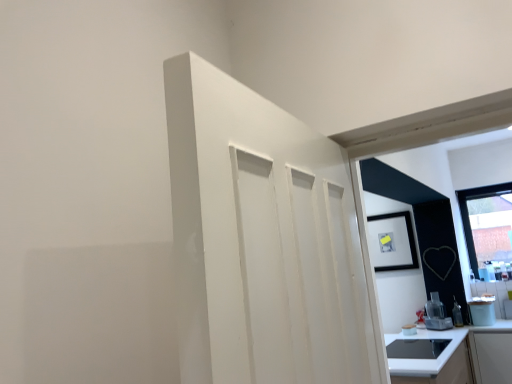
Describe the element at coordinates (482, 311) in the screenshot. I see `white glossy coffee maker at right, which ranks as the 1th appliance in right-to-left order` at that location.

The width and height of the screenshot is (512, 384). What do you see at coordinates (456, 356) in the screenshot?
I see `white glossy countertop at lower right` at bounding box center [456, 356].

You are a GUI agent. You are given a task and a screenshot of the screen. Output one action in this format:
    pyautogui.click(x=<x>, y=<y>)
    Task: Click on the white glossy countertop at lower right
    This screenshot has width=512, height=384.
    Given the screenshot: What is the action you would take?
    pyautogui.click(x=456, y=356)

Identify the location of matte black picture frame at upper right. This screenshot has width=512, height=384. (392, 242).

The width and height of the screenshot is (512, 384). What do you see at coordinates (392, 242) in the screenshot? I see `matte black picture frame at upper right` at bounding box center [392, 242].

Measure the distance between point (474, 189) and camera.

Point (474, 189) and camera are 14.65 feet apart from each other.

What are the coordinates of `satin silver blender at lower right, the 1th appliance positioned from the left` in the screenshot? It's located at (436, 314).

Is matte black picture frame at upper right in front of or behind white glossy countertop at lower right in the image?

Visually, matte black picture frame at upper right is located behind white glossy countertop at lower right.

Can you confirm if matte black picture frame at upper right is thinner than white glossy countertop at lower right?

Indeed, matte black picture frame at upper right has a lesser width compared to white glossy countertop at lower right.

Is point (411, 262) positioned before point (490, 372)?

No, it is not.

What's the angular difference between matte black picture frame at upper right and white glossy countertop at lower right's facing directions?

90 degrees.

From the image's perspective, is white glossy countertop at lower right on top of matte black picture frame at upper right?

Actually, white glossy countertop at lower right appears below matte black picture frame at upper right in the image.

Looking at their sizes, would you say white glossy countertop at lower right is wider or thinner than matte black picture frame at upper right?

Considering their sizes, white glossy countertop at lower right looks broader than matte black picture frame at upper right.

Considering the positions of point (484, 358) and point (380, 236), is point (484, 358) closer or farther from the camera than point (380, 236)?

Point (484, 358) appears to be closer to the viewer than point (380, 236).

In the scene shown: Is satin silver blender at lower right, which is the second appliance from right to left, positioned with its back to transparent glass window at upper right?

No, satin silver blender at lower right, which is the second appliance from right to left, is not facing the opposite direction of transparent glass window at upper right.

Is satin silver blender at lower right, which is the second appliance from right to left, inside or outside of transparent glass window at upper right?

The correct answer is: outside.

Between satin silver blender at lower right, the 1th appliance positioned from the left, and transparent glass window at upper right, which one has smaller size?

With smaller size is satin silver blender at lower right, the 1th appliance positioned from the left.

Which point is more distant from viewer, (434, 309) or (468, 232)?

The point (434, 309) is farther from the camera.

Does matte black picture frame at upper right appear on the left side of transparent glass window at upper right?

Correct, you'll find matte black picture frame at upper right to the left of transparent glass window at upper right.

In terms of width, does matte black picture frame at upper right look wider or thinner when compared to transparent glass window at upper right?

matte black picture frame at upper right is thinner than transparent glass window at upper right.

Does matte black picture frame at upper right touch transparent glass window at upper right?

No, matte black picture frame at upper right is not next to transparent glass window at upper right.

Which object is closer to the camera taking this photo, satin silver blender at lower right, which is the second appliance from right to left, or white glossy coffee maker at right, which ranks as the 1th appliance in right-to-left order?

Positioned in front is white glossy coffee maker at right, which ranks as the 1th appliance in right-to-left order.

Is satin silver blender at lower right, which is the second appliance from right to left, far away from white glossy coffee maker at right, which ranks as the 1th appliance in right-to-left order?

Actually, satin silver blender at lower right, which is the second appliance from right to left, and white glossy coffee maker at right, which ranks as the 1th appliance in right-to-left order, are a little close together.

Is satin silver blender at lower right, the 1th appliance positioned from the left, outside of white glossy coffee maker at right, arranged as the second appliance when viewed from the left?

Indeed, satin silver blender at lower right, the 1th appliance positioned from the left, is completely outside white glossy coffee maker at right, arranged as the second appliance when viewed from the left.

In the scene shown: Is white glossy coffee maker at right, arranged as the second appliance when viewed from the left, outside of matte black picture frame at upper right?

Yes, white glossy coffee maker at right, arranged as the second appliance when viewed from the left, is located beyond the bounds of matte black picture frame at upper right.

What's the angular difference between white glossy coffee maker at right, arranged as the second appliance when viewed from the left, and matte black picture frame at upper right's facing directions?

The angular difference between white glossy coffee maker at right, arranged as the second appliance when viewed from the left, and matte black picture frame at upper right is 0.00112 degrees.

Considering the relative positions of white glossy coffee maker at right, which ranks as the 1th appliance in right-to-left order, and matte black picture frame at upper right in the image provided, is white glossy coffee maker at right, which ranks as the 1th appliance in right-to-left order, to the left or to the right of matte black picture frame at upper right?

Clearly, white glossy coffee maker at right, which ranks as the 1th appliance in right-to-left order, is on the right of matte black picture frame at upper right in the image.

Is white glossy coffee maker at right, which ranks as the 1th appliance in right-to-left order, oriented away from matte black picture frame at upper right?

white glossy coffee maker at right, which ranks as the 1th appliance in right-to-left order, does not have its back to matte black picture frame at upper right.

Considering the relative sizes of white glossy countertop at lower right and transparent glass window at upper right in the image provided, is white glossy countertop at lower right taller than transparent glass window at upper right?

No, white glossy countertop at lower right is not taller than transparent glass window at upper right.

Between white glossy countertop at lower right and transparent glass window at upper right, which one appears on the left side from the viewer's perspective?

white glossy countertop at lower right is more to the left.

Considering the sizes of objects white glossy countertop at lower right and transparent glass window at upper right in the image provided, who is bigger, white glossy countertop at lower right or transparent glass window at upper right?

white glossy countertop at lower right is bigger.

At what (x,y) coordinates should I click in order to perform the action: click on picture frame that is on the right side of white glossy countertop at lower right. Please return your answer as a coordinate pair (x, y). The image size is (512, 384). Looking at the image, I should click on (392, 242).

You are a GUI agent. You are given a task and a screenshot of the screen. Output one action in this format:
    pyautogui.click(x=<x>, y=<y>)
    Task: Click on the countertop that appears below the matte black picture frame at upper right (from a real-world perspective)
    
    Given the screenshot: What is the action you would take?
    pyautogui.click(x=456, y=356)

When comparing their distances from satin silver blender at lower right, the 1th appliance positioned from the left, does white glossy countertop at lower right or transparent glass window at upper right seem further?

white glossy countertop at lower right is further to satin silver blender at lower right, the 1th appliance positioned from the left.

Estimate the real-world distances between objects in this image. Which object is closer to white glossy countertop at lower right, matte black picture frame at upper right or transparent glass window at upper right?

The object closer to white glossy countertop at lower right is transparent glass window at upper right.

When comparing their distances from white glossy countertop at lower right, does satin silver blender at lower right, which is the second appliance from right to left, or white glossy coffee maker at right, arranged as the second appliance when viewed from the left, seem further?

satin silver blender at lower right, which is the second appliance from right to left.

From the image, which object appears to be farther from satin silver blender at lower right, which is the second appliance from right to left, white glossy countertop at lower right or white glossy coffee maker at right, which ranks as the 1th appliance in right-to-left order?

white glossy countertop at lower right lies further to satin silver blender at lower right, which is the second appliance from right to left, than the other object.

From the image, which object appears to be nearer to satin silver blender at lower right, the 1th appliance positioned from the left, transparent glass window at upper right or matte black picture frame at upper right?

matte black picture frame at upper right is positioned closer to the anchor satin silver blender at lower right, the 1th appliance positioned from the left.

When comparing their distances from white glossy countertop at lower right, does transparent glass window at upper right or white glossy coffee maker at right, arranged as the second appliance when viewed from the left, seem closer?

white glossy coffee maker at right, arranged as the second appliance when viewed from the left, lies closer to white glossy countertop at lower right than the other object.

Looking at the image, which one is located further to white glossy coffee maker at right, arranged as the second appliance when viewed from the left, satin silver blender at lower right, which is the second appliance from right to left, or transparent glass window at upper right?

transparent glass window at upper right.

Estimate the real-world distances between objects in this image. Which object is closer to matte black picture frame at upper right, transparent glass window at upper right or white glossy countertop at lower right?

transparent glass window at upper right is positioned closer to the anchor matte black picture frame at upper right.

Image resolution: width=512 pixels, height=384 pixels. What are the coordinates of `window between white glossy countertop at lower right and matte black picture frame at upper right from front to back` in the screenshot? It's located at (468, 214).

At what (x,y) coordinates should I click in order to perform the action: click on appliance between transparent glass window at upper right and satin silver blender at lower right, which is the second appliance from right to left, in the vertical direction. Please return your answer as a coordinate pair (x, y). This screenshot has height=384, width=512. Looking at the image, I should click on (482, 311).

What are the coordinates of `appliance between white glossy countertop at lower right and satin silver blender at lower right, which is the second appliance from right to left, from front to back` in the screenshot? It's located at (482, 311).

Find the location of a particular element. This screenshot has height=384, width=512. appliance between white glossy coffee maker at right, arranged as the second appliance when viewed from the left, and matte black picture frame at upper right from front to back is located at coordinates [436, 314].